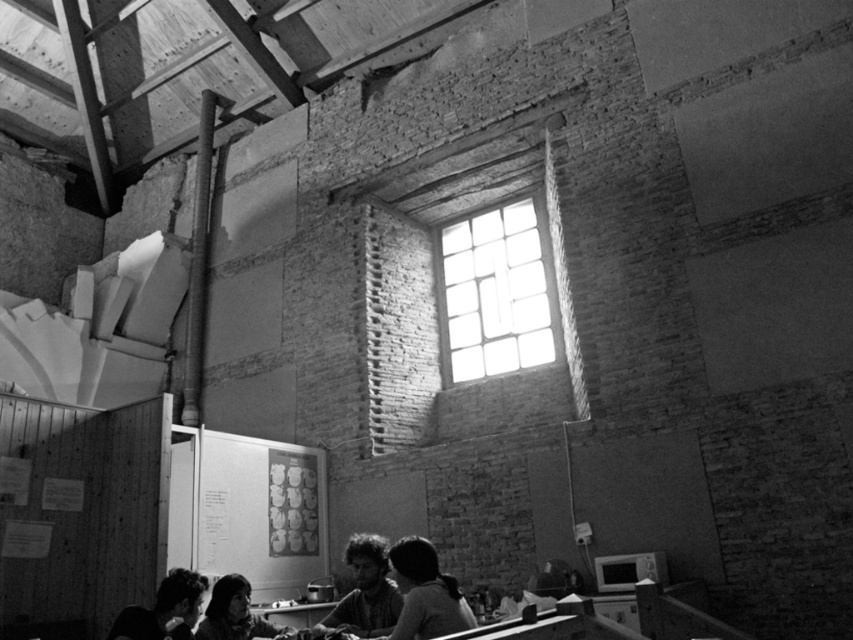
Looking at this image, who is taller, smooth black hair at lower center or smooth black hair at lower left?

Standing taller between the two is smooth black hair at lower center.

At what (x,y) coordinates should I click in order to perform the action: click on smooth black hair at lower center. Please return your answer as a coordinate pair (x, y). This screenshot has height=640, width=853. Looking at the image, I should click on (425, 593).

Does point (404, 570) lie behind point (149, 612)?

That is False.

Locate an element on the screen. smooth black hair at lower center is located at coordinates (425, 593).

Find the location of a particular element. Image resolution: width=853 pixels, height=640 pixels. dark hair at center is located at coordinates (364, 589).

Does dark hair at center come in front of smooth skin at lower left?

Yes, it is.

This screenshot has width=853, height=640. What are the coordinates of `dark hair at center` in the screenshot? It's located at (364, 589).

Who is positioned more to the right, dark hair at center or smooth black hair at lower left?

dark hair at center

Does dark hair at center appear over smooth black hair at lower left?

Incorrect, dark hair at center is not positioned above smooth black hair at lower left.

Is point (396, 588) closer to viewer compared to point (195, 589)?

No.

Identify the location of dark hair at center. This screenshot has height=640, width=853. (364, 589).